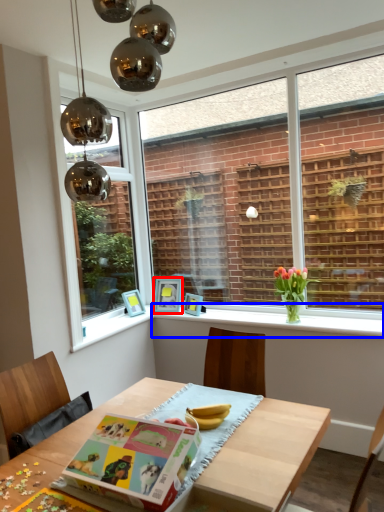
Question: Which object appears closest to the camera in this image, picture frame (highlighted by a red box) or window sill (highlighted by a blue box)?

Choices:
 (A) picture frame
 (B) window sill

Answer: (B)